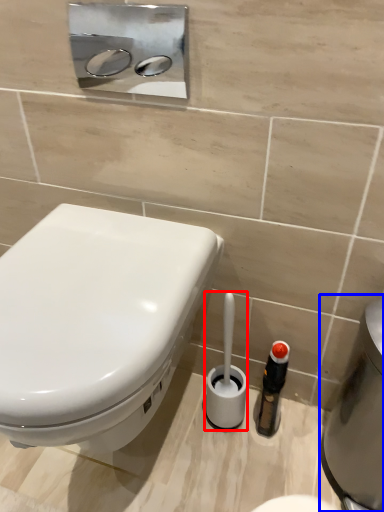
Question: Which point is further to the camera, brush (highlighted by a red box) or water heater (highlighted by a blue box)?

Choices:
 (A) brush
 (B) water heater

Answer: (A)